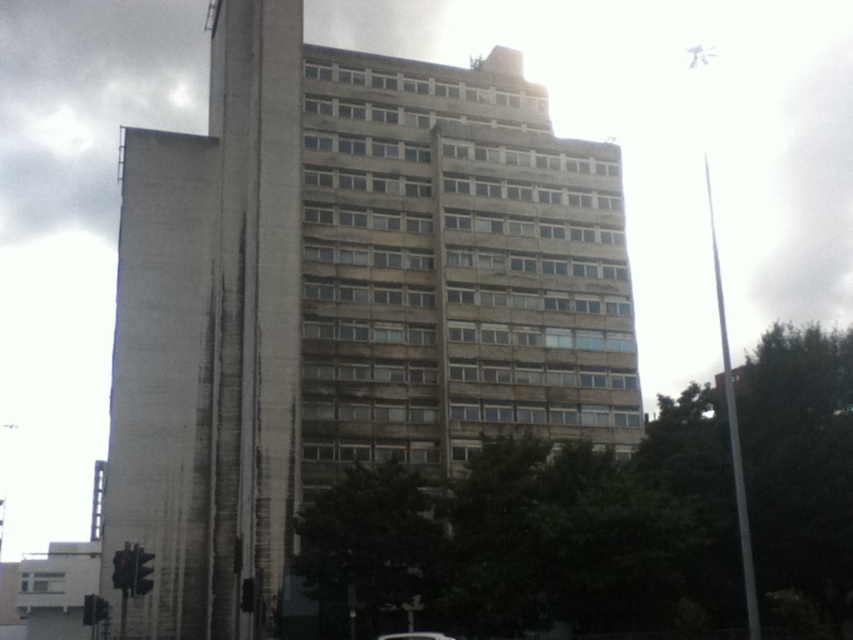
Question: Which object is farther from the camera taking this photo?

Choices:
 (A) metallic silver car at lower center
 (B) concrete building at center

Answer: (B)

Question: From the image, what is the correct spatial relationship of concrete building at center in relation to metallic silver car at lower center?

Choices:
 (A) right
 (B) left

Answer: (B)

Question: Is concrete building at center positioned at the back of metallic silver car at lower center?

Choices:
 (A) yes
 (B) no

Answer: (A)

Question: Is concrete building at center closer to the viewer compared to metallic silver car at lower center?

Choices:
 (A) yes
 (B) no

Answer: (B)